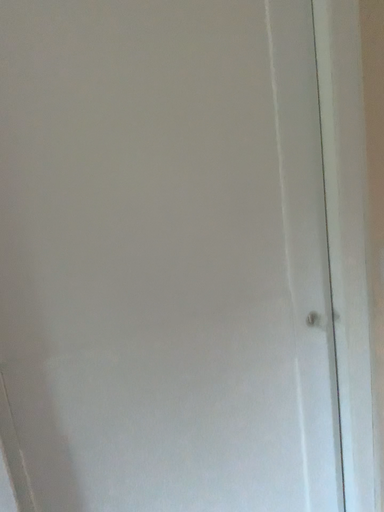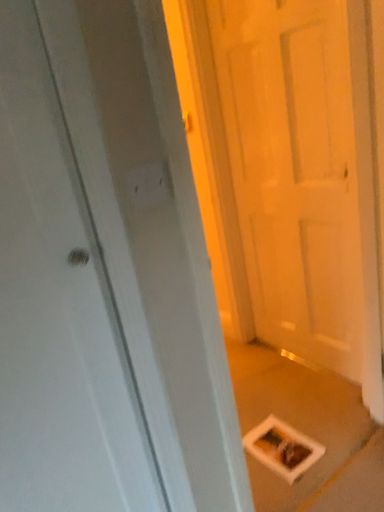
Question: How did the camera likely rotate when shooting the video?

Choices:
 (A) rotated left
 (B) rotated right

Answer: (B)